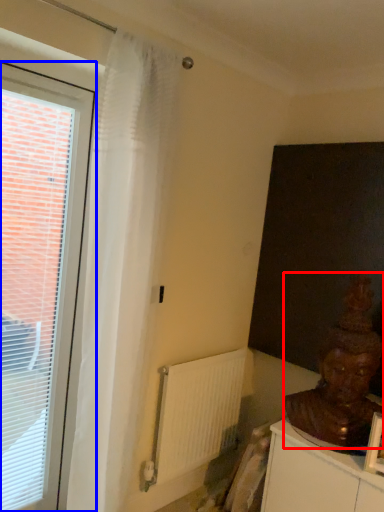
Question: Which object appears closest to the camera in this image, person (highlighted by a red box) or window (highlighted by a blue box)?

Choices:
 (A) person
 (B) window

Answer: (B)